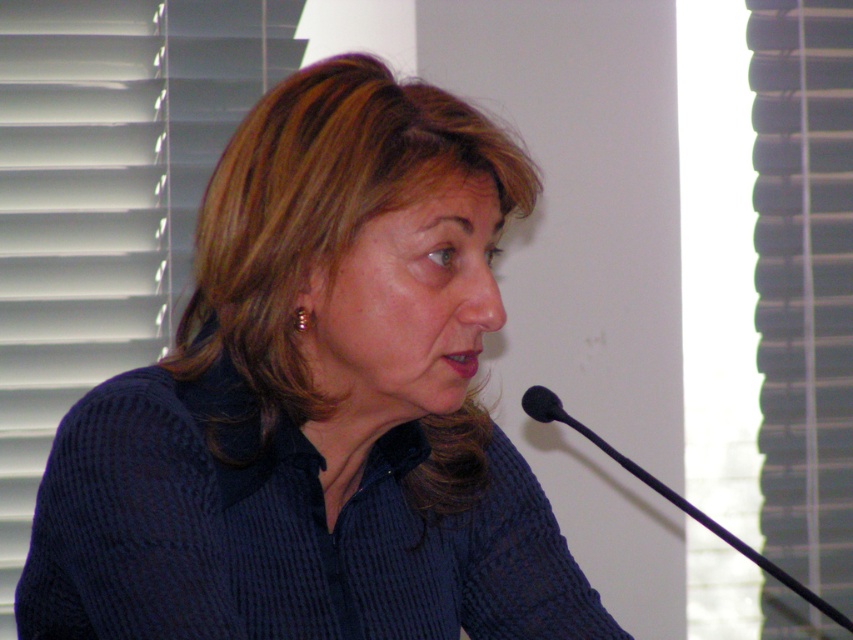
Between point (140, 497) and point (822, 605), which one is positioned in front?

Point (140, 497) is more forward.

Which is behind, point (490, 442) or point (744, 547)?

The point (744, 547) is more distant.

Which is in front, point (457, 236) or point (715, 529)?

Point (457, 236)

Locate an element on the screen. The height and width of the screenshot is (640, 853). dark blue textured shirt at center is located at coordinates (317, 403).

Is dark blue textured shirt at center wider than white plastic blinds at right?

Yes.

Does point (482, 512) come closer to viewer compared to point (780, 508)?

That is True.

Between point (289, 308) and point (755, 67), which one is positioned behind?

The point (755, 67) is behind.

The image size is (853, 640). Identify the location of dark blue textured shirt at center. (317, 403).

Can you confirm if black matte microphone at lower right is taller than black plastic microphone at lower right?

Yes, black matte microphone at lower right is taller than black plastic microphone at lower right.

Is point (669, 497) positioned before point (538, 419)?

No, it is behind (538, 419).

Is point (784, 573) in front of point (554, 416)?

No, (784, 573) is behind (554, 416).

Identify the location of black matte microphone at lower right. Image resolution: width=853 pixels, height=640 pixels. (712, 525).